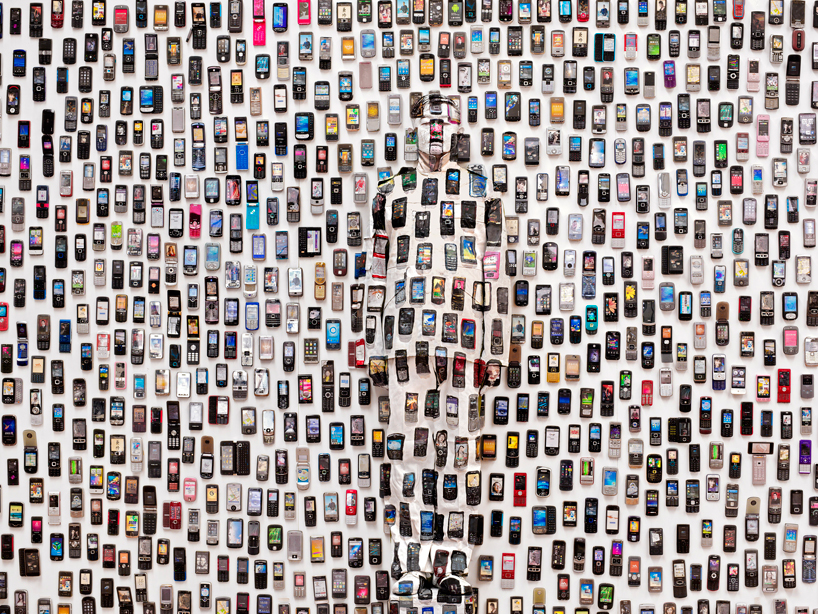
In order to click on phone in this screenshot , I will do `click(569, 478)`.